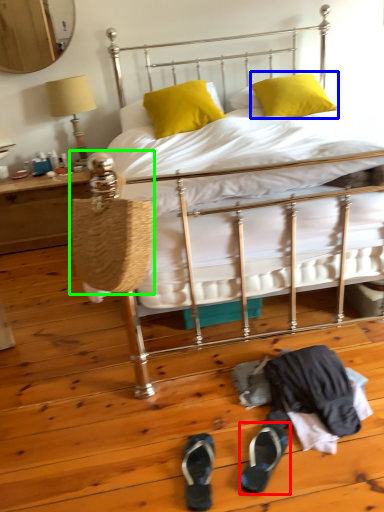
Question: Which object is positioned closest to footwear (highlighted by a red box)? Select from pillow (highlighted by a blue box) and handbag (highlighted by a green box).

Choices:
 (A) pillow
 (B) handbag

Answer: (B)